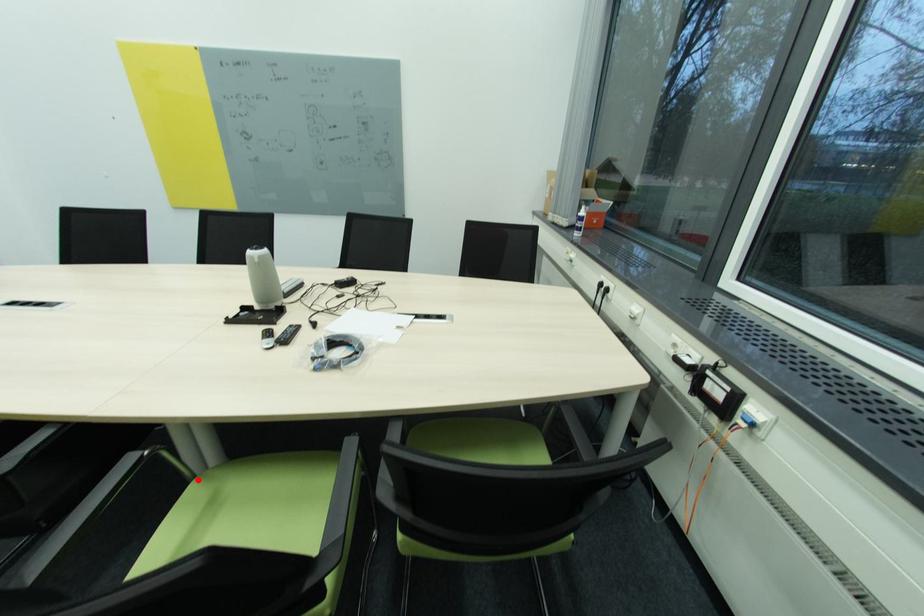
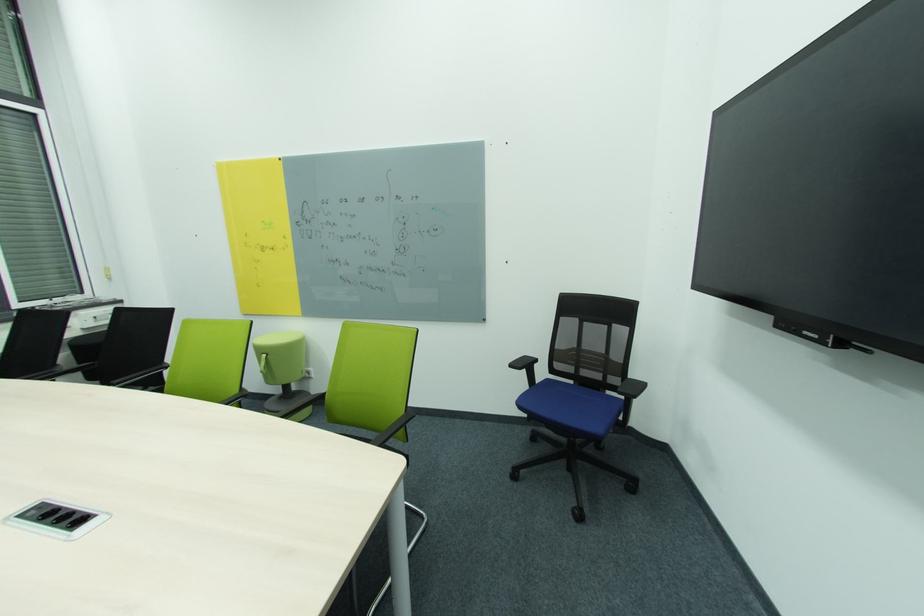
Question: I am providing you with two images of the same scene from different viewpoints. A red point is marked on the first image. Can you still see the location of the red point in image 2?

Choices:
 (A) Yes
 (B) No

Answer: (B)